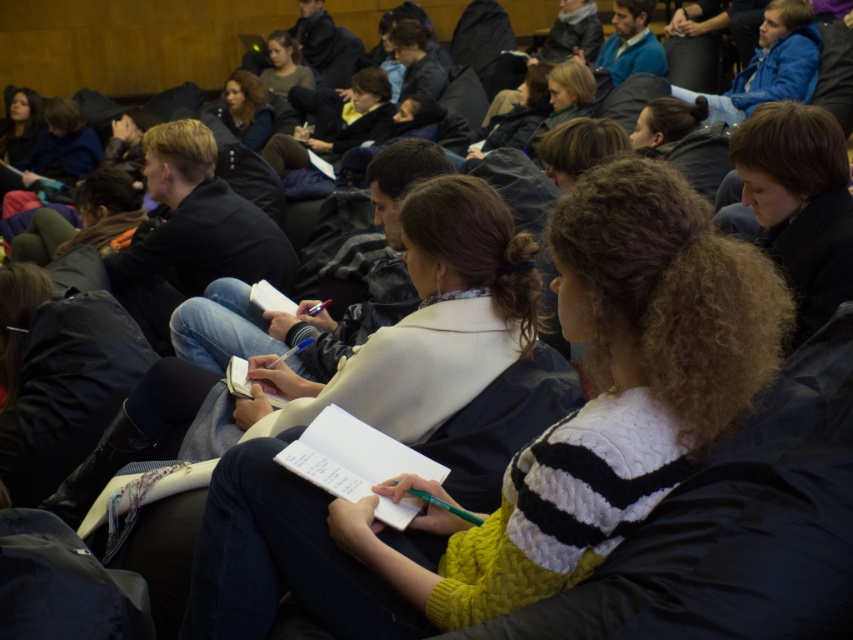
Is yellow knit sweater at center smaller than matte black jacket at upper center?

No.

Who is more forward, (242, 476) or (252, 74)?

Point (242, 476)

Measure the distance between yellow knit sweater at center and camera.

The distance of yellow knit sweater at center from camera is 5.03 feet.

This screenshot has height=640, width=853. Find the location of `yellow knit sweater at center`. yellow knit sweater at center is located at coordinates (527, 444).

Can you confirm if yellow knit sweater at center is positioned to the right of blue knit sweater at upper right?

Incorrect, yellow knit sweater at center is not on the right side of blue knit sweater at upper right.

Is yellow knit sweater at center taller than blue knit sweater at upper right?

Indeed, yellow knit sweater at center has a greater height compared to blue knit sweater at upper right.

Is point (500, 596) positioned behind point (616, 13)?

No, it is in front of (616, 13).

Locate an element on the screen. The width and height of the screenshot is (853, 640). yellow knit sweater at center is located at coordinates (527, 444).

In the scene shown: Who is higher up, yellow knit sweater at center or blue cotton jacket at upper right?

blue cotton jacket at upper right

Is point (564, 234) closer to camera compared to point (792, 12)?

Yes, point (564, 234) is closer to viewer.

Where is `yellow knit sweater at center`? yellow knit sweater at center is located at coordinates (527, 444).

Locate an element on the screen. This screenshot has width=853, height=640. yellow knit sweater at center is located at coordinates (527, 444).